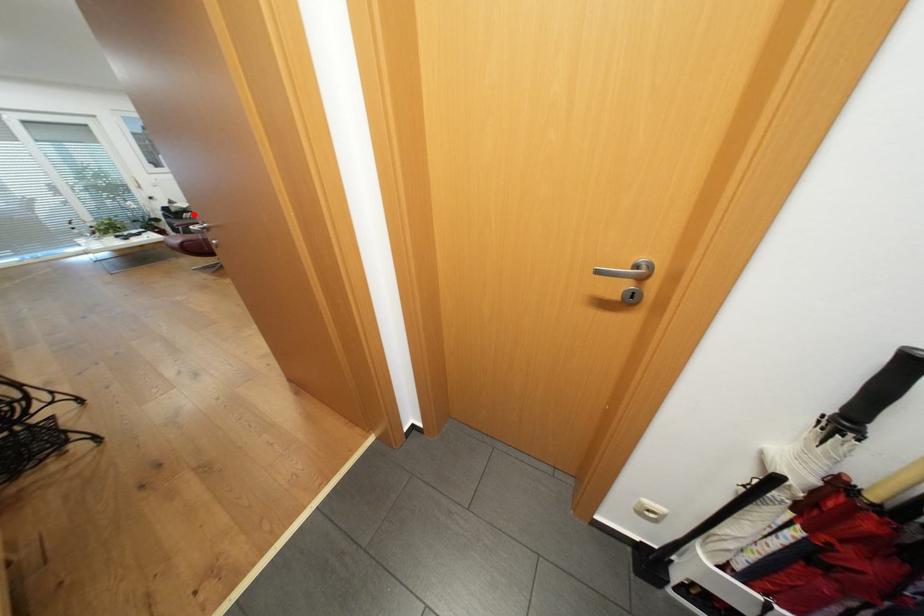
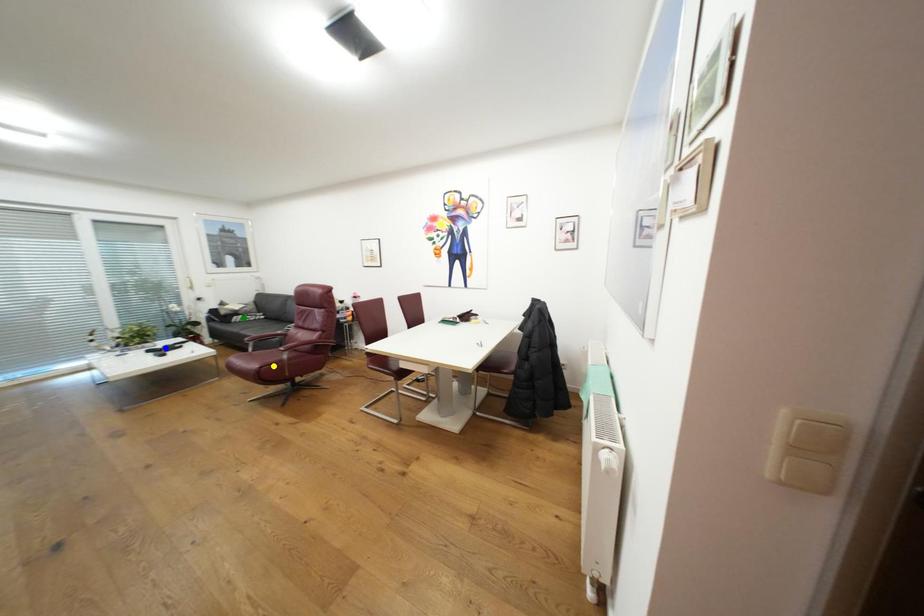
Question: I am providing you with two images of the same scene from different viewpoints. A red point is marked on the first image. You are given multiple points on the second image. Which point in image 2 is actually the same real-world point as the red point in image 1?

Choices:
 (A) blue point
 (B) green point
 (C) yellow point

Answer: (B)